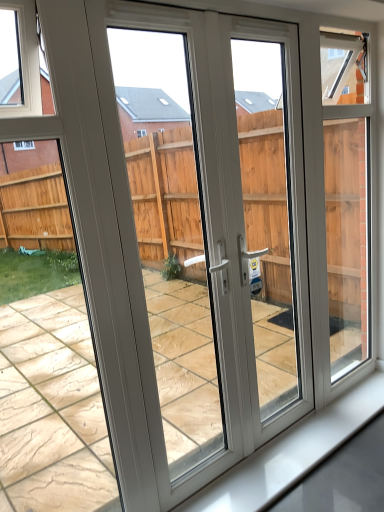
Find the location of a particular element. The width and height of the screenshot is (384, 512). white plastic screen door at center, the first screen door viewed from the right is located at coordinates (273, 222).

At what (x,y) coordinates should I click in order to perform the action: click on white glossy window sill at lower center. Please return your answer as a coordinate pair (x, y). Looking at the image, I should click on (292, 452).

This screenshot has width=384, height=512. I want to click on white plastic screen door at center, which is the second screen door in right-to-left order, so click(x=178, y=288).

Is white plastic screen door at center, which is the second screen door in right-to-left order, looking in the opposite direction of white plastic screen door at center, the first screen door viewed from the right?

No, white plastic screen door at center, the first screen door viewed from the right, is not at the back of white plastic screen door at center, which is the second screen door in right-to-left order.

Which is more to the right, white plastic screen door at center, which is the second screen door in right-to-left order, or white plastic screen door at center, placed as the 2th screen door when sorted from left to right?

Positioned to the right is white plastic screen door at center, placed as the 2th screen door when sorted from left to right.

What are the coordinates of `screen door that is in front of the white plastic screen door at center, placed as the 2th screen door when sorted from left to right` in the screenshot? It's located at (178, 288).

Considering the sizes of objects white plastic screen door at center, which is the second screen door in right-to-left order, and white plastic screen door at center, the first screen door viewed from the right, in the image provided, who is bigger, white plastic screen door at center, which is the second screen door in right-to-left order, or white plastic screen door at center, the first screen door viewed from the right,?

Bigger between the two is white plastic screen door at center, which is the second screen door in right-to-left order.

Would you say white plastic screen door at center, which is the second screen door in right-to-left order, is outside white glossy window sill at lower center?

white plastic screen door at center, which is the second screen door in right-to-left order, is positioned outside white glossy window sill at lower center.

The width and height of the screenshot is (384, 512). In order to click on window sill below the white plastic screen door at center, which is the second screen door in right-to-left order (from a real-world perspective) in this screenshot , I will do `click(292, 452)`.

From a real-world perspective, who is located higher, white plastic screen door at center, placed as the first screen door when sorted from left to right, or white glossy window sill at lower center?

white plastic screen door at center, placed as the first screen door when sorted from left to right, is physically above.

Which is more to the left, white plastic screen door at center, which is the second screen door in right-to-left order, or white glossy window sill at lower center?

Positioned to the left is white plastic screen door at center, which is the second screen door in right-to-left order.

Is white plastic screen door at center, the first screen door viewed from the right, wider than white plastic screen door at center, which is the second screen door in right-to-left order?

Incorrect, the width of white plastic screen door at center, the first screen door viewed from the right, does not surpass that of white plastic screen door at center, which is the second screen door in right-to-left order.

Consider the image. Measure the distance between white plastic screen door at center, the first screen door viewed from the right, and white plastic screen door at center, which is the second screen door in right-to-left order.

The distance of white plastic screen door at center, the first screen door viewed from the right, from white plastic screen door at center, which is the second screen door in right-to-left order, is 29.80 inches.

Considering the positions of objects white plastic screen door at center, placed as the 2th screen door when sorted from left to right, and white plastic screen door at center, placed as the first screen door when sorted from left to right, in the image provided, who is in front, white plastic screen door at center, placed as the 2th screen door when sorted from left to right, or white plastic screen door at center, placed as the first screen door when sorted from left to right,?

white plastic screen door at center, placed as the first screen door when sorted from left to right, is more forward.

Is white plastic screen door at center, placed as the first screen door when sorted from left to right, a part of white plastic screen door at center, placed as the 2th screen door when sorted from left to right?

No, white plastic screen door at center, placed as the first screen door when sorted from left to right, is not surrounded by white plastic screen door at center, placed as the 2th screen door when sorted from left to right.

Which object is more forward, white glossy window sill at lower center or white plastic screen door at center, placed as the first screen door when sorted from left to right?

white plastic screen door at center, placed as the first screen door when sorted from left to right.

Does white glossy window sill at lower center turn towards white plastic screen door at center, which is the second screen door in right-to-left order?

No, white glossy window sill at lower center does not turn towards white plastic screen door at center, which is the second screen door in right-to-left order.

From a real-world perspective, is white glossy window sill at lower center physically located above or below white plastic screen door at center, which is the second screen door in right-to-left order?

white glossy window sill at lower center is below white plastic screen door at center, which is the second screen door in right-to-left order.

From the image's perspective, which is above, white glossy window sill at lower center or white plastic screen door at center, placed as the first screen door when sorted from left to right?

white plastic screen door at center, placed as the first screen door when sorted from left to right, is shown above in the image.

Can you tell me how much white glossy window sill at lower center and white plastic screen door at center, placed as the 2th screen door when sorted from left to right, differ in facing direction?

0.252 degrees.

How far apart are white glossy window sill at lower center and white plastic screen door at center, placed as the 2th screen door when sorted from left to right?

white glossy window sill at lower center and white plastic screen door at center, placed as the 2th screen door when sorted from left to right, are 32.85 inches apart.

From a real-world perspective, is white glossy window sill at lower center above or below white plastic screen door at center, placed as the 2th screen door when sorted from left to right?

white glossy window sill at lower center is situated lower than white plastic screen door at center, placed as the 2th screen door when sorted from left to right, in the real world.

Could you tell me if white glossy window sill at lower center is facing white plastic screen door at center, placed as the 2th screen door when sorted from left to right?

No, white glossy window sill at lower center is not turned towards white plastic screen door at center, placed as the 2th screen door when sorted from left to right.

Based on the photo, is white plastic screen door at center, the first screen door viewed from the right, taller or shorter than white glossy window sill at lower center?

Considering their sizes, white plastic screen door at center, the first screen door viewed from the right, has more height than white glossy window sill at lower center.

From the image's perspective, which one is positioned higher, white plastic screen door at center, placed as the 2th screen door when sorted from left to right, or white glossy window sill at lower center?

white plastic screen door at center, placed as the 2th screen door when sorted from left to right, from the image's perspective.

Where is `window sill behind the white plastic screen door at center, the first screen door viewed from the right`? Image resolution: width=384 pixels, height=512 pixels. window sill behind the white plastic screen door at center, the first screen door viewed from the right is located at coordinates (292, 452).

What's the angular difference between white plastic screen door at center, placed as the 2th screen door when sorted from left to right, and white glossy window sill at lower center's facing directions?

The angular difference between white plastic screen door at center, placed as the 2th screen door when sorted from left to right, and white glossy window sill at lower center is 0.252 degrees.

The height and width of the screenshot is (512, 384). I want to click on screen door lying in front of the white plastic screen door at center, placed as the 2th screen door when sorted from left to right, so click(x=178, y=288).

In the image, there is a white plastic screen door at center, placed as the first screen door when sorted from left to right. Find the location of `window sill below it (from a real-world perspective)`. window sill below it (from a real-world perspective) is located at coordinates (292, 452).

Considering their positions, is white plastic screen door at center, the first screen door viewed from the right, positioned closer to white glossy window sill at lower center than white plastic screen door at center, placed as the first screen door when sorted from left to right?

white plastic screen door at center, the first screen door viewed from the right, lies closer to white glossy window sill at lower center than the other object.

When comparing their distances from white plastic screen door at center, the first screen door viewed from the right, does white plastic screen door at center, which is the second screen door in right-to-left order, or white glossy window sill at lower center seem closer?

white plastic screen door at center, which is the second screen door in right-to-left order, is positioned closer to the anchor white plastic screen door at center, the first screen door viewed from the right.

Based on their spatial positions, is white plastic screen door at center, the first screen door viewed from the right, or white glossy window sill at lower center further from white plastic screen door at center, which is the second screen door in right-to-left order?

white glossy window sill at lower center.

Looking at the image, which one is located closer to white plastic screen door at center, placed as the first screen door when sorted from left to right, white glossy window sill at lower center or white plastic screen door at center, placed as the 2th screen door when sorted from left to right?

Based on the image, white plastic screen door at center, placed as the 2th screen door when sorted from left to right, appears to be nearer to white plastic screen door at center, placed as the first screen door when sorted from left to right.

Based on their spatial positions, is white plastic screen door at center, placed as the first screen door when sorted from left to right, or white plastic screen door at center, placed as the 2th screen door when sorted from left to right, further from white glossy window sill at lower center?

Based on the image, white plastic screen door at center, placed as the first screen door when sorted from left to right, appears to be further to white glossy window sill at lower center.

From the picture: Considering their positions, is white glossy window sill at lower center positioned closer to white plastic screen door at center, placed as the 2th screen door when sorted from left to right, than white plastic screen door at center, placed as the first screen door when sorted from left to right?

Among the two, white plastic screen door at center, placed as the first screen door when sorted from left to right, is located nearer to white plastic screen door at center, placed as the 2th screen door when sorted from left to right.

Find the location of a particular element. screen door between white plastic screen door at center, the first screen door viewed from the right, and white glossy window sill at lower center, in the vertical direction is located at coordinates (178, 288).